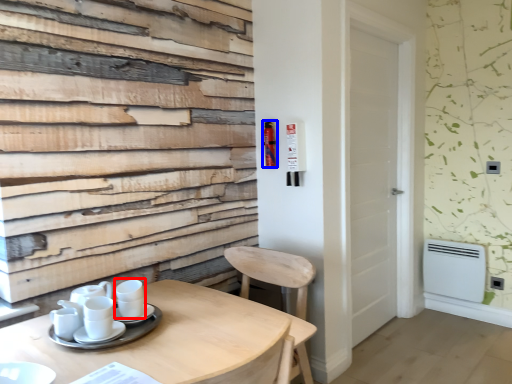
Question: Which object appears closest to the camera in this image, coffee cup (highlighted by a red box) or extinguisher (highlighted by a blue box)?

Choices:
 (A) coffee cup
 (B) extinguisher

Answer: (A)